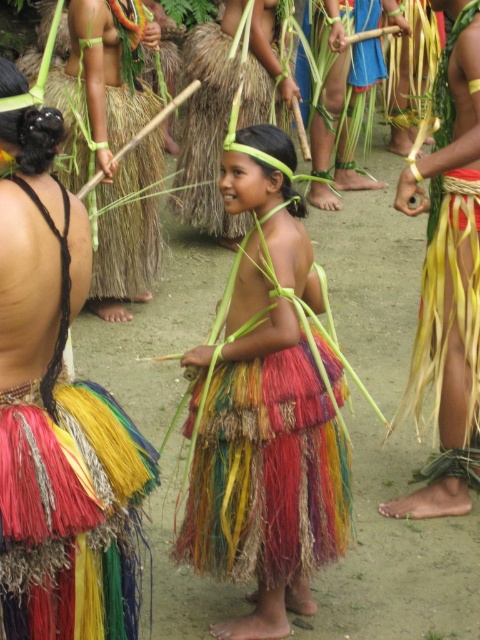
You are a photographer standing at the front of the crowd watching the dance. You want to take a closeup shot of the multicolored grass skirt at center. Your camera has a minimum focusing distance of 2 meters. Will you be able to take the closeup without moving closer?

The multicolored grass skirt at center is 2.77 meters away from the viewer. Since your camera can focus as close as 2 meters, you are currently 0.77 meters too far away to capture the closeup. You need to move 0.77 meters closer to be within the minimum focusing range.

You are a photographer trying to capture the central dancer in the vibrant cultural scene. You notice two points marked in the image. The first point is at coordinate point (x=330, y=358) and the second is at point (x=194, y=48). Which point is closer to your camera lens?

Point (x=330, y=358) is closer to the camera than point (x=194, y=48).

You are a photographer at the event and want to capture the central dancer. Which of the two skirts, the multicolored grass skirt at center or the multicolored woven skirt at center, is closer to your camera lens?

The multicolored grass skirt at center is closer to your camera lens because it is in front of the multicolored woven skirt at center.